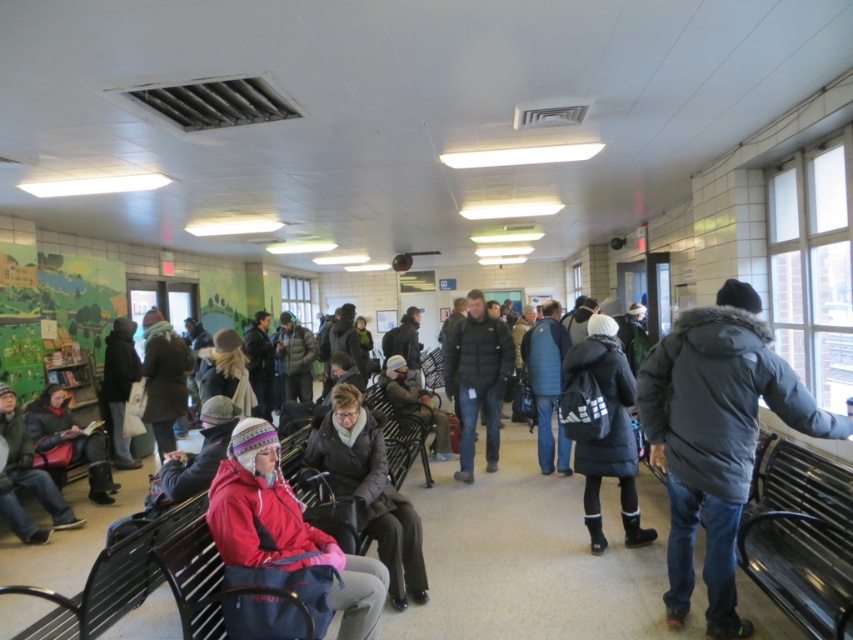
Is point (466, 330) less distant than point (544, 404)?

Yes, point (466, 330) is closer to viewer.

Which of these two, dark gray puffy jacket at center or blue fabric jacket at center, stands shorter?

blue fabric jacket at center

Is point (500, 397) behind point (531, 332)?

No, it is in front of (531, 332).

I want to click on dark gray puffy jacket at center, so click(x=477, y=378).

Is black matte backpack at center bigger than matte black jacket at lower left?

Yes.

Between black matte backpack at center and matte black jacket at lower left, which one is positioned higher?

black matte backpack at center is above.

Find the location of a particular element. This screenshot has width=853, height=640. black matte backpack at center is located at coordinates (601, 428).

Looking at this image, who is taller, matte red jacket at lower left or matte black jacket at center?

Standing taller between the two is matte black jacket at center.

Where is `matte red jacket at lower left`? matte red jacket at lower left is located at coordinates (286, 529).